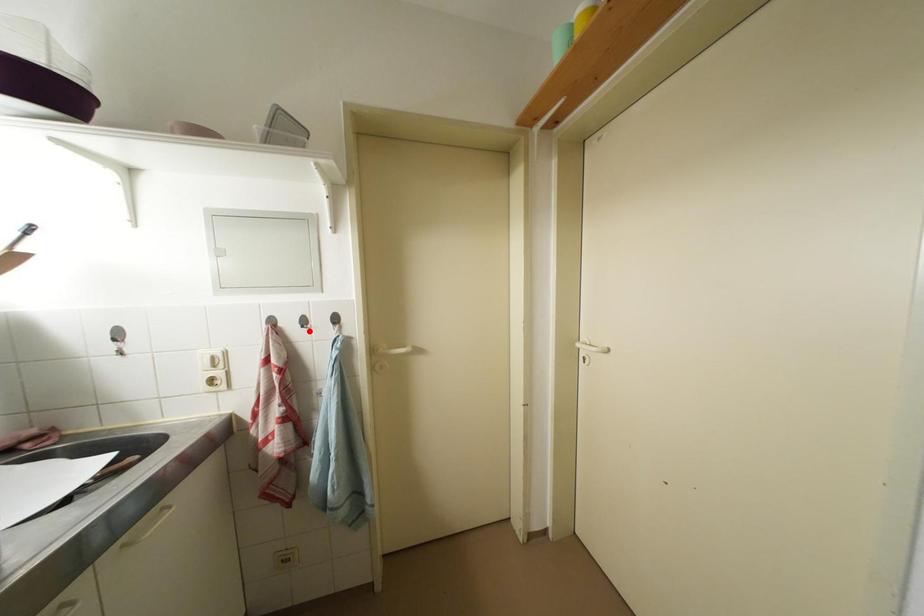
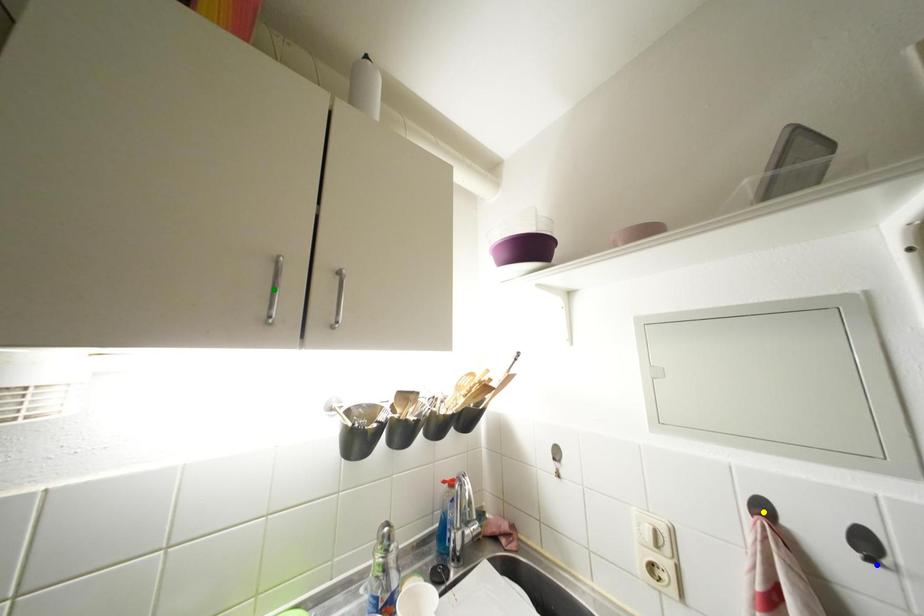
Question: I am providing you with two images of the same scene from different viewpoints. A red point is marked on the first image. You are given multiple points on the second image. Which spot in image 2 lines up with the point in image 1?

Choices:
 (A) yellow point
 (B) blue point
 (C) green point

Answer: (B)